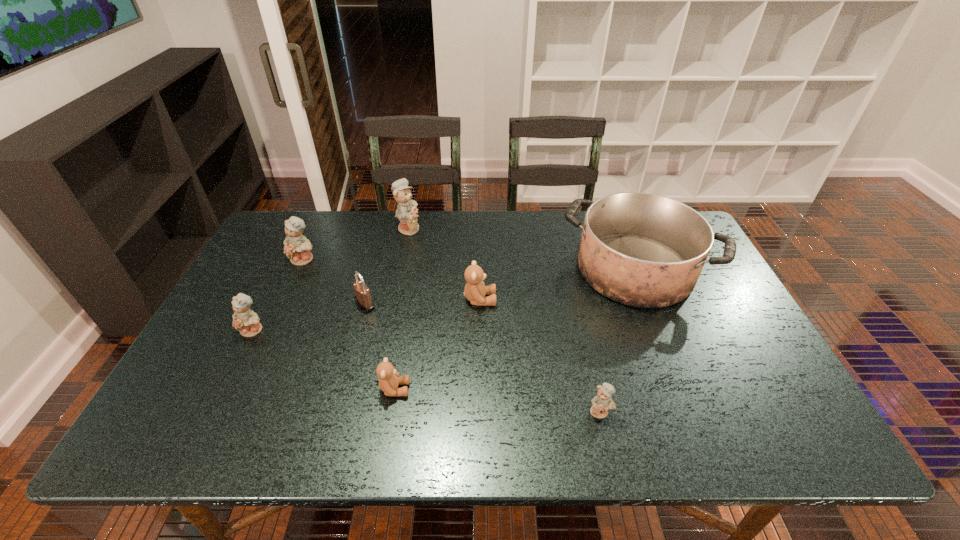
This screenshot has height=540, width=960. What are the coordinates of `vacant space situated on the face of the nearer brown teddy bear` in the screenshot? It's located at (505, 389).

Image resolution: width=960 pixels, height=540 pixels. Identify the location of saucepan that is at the far edge. (644, 250).

Find the location of `object at the near edge`. object at the near edge is located at coordinates (601, 403).

Identify the location of object that is at the right edge. (644, 250).

The image size is (960, 540). I want to click on object situated at the far left corner, so click(297, 247).

Where is `object that is at the far right corner`? The height and width of the screenshot is (540, 960). object that is at the far right corner is located at coordinates (644, 250).

In the image, there is a desktop. Where is `vacant space at the far edge`? The height and width of the screenshot is (540, 960). vacant space at the far edge is located at coordinates (393, 250).

In the image, there is a desktop. Identify the location of vacant area at the near edge. (493, 414).

Where is `free space at the left edge of the desktop`? The image size is (960, 540). free space at the left edge of the desktop is located at coordinates 204,392.

At what (x,y) coordinates should I click in order to perform the action: click on vacant space at the right edge of the desktop. Please return your answer as a coordinate pair (x, y). The width and height of the screenshot is (960, 540). Looking at the image, I should click on (773, 376).